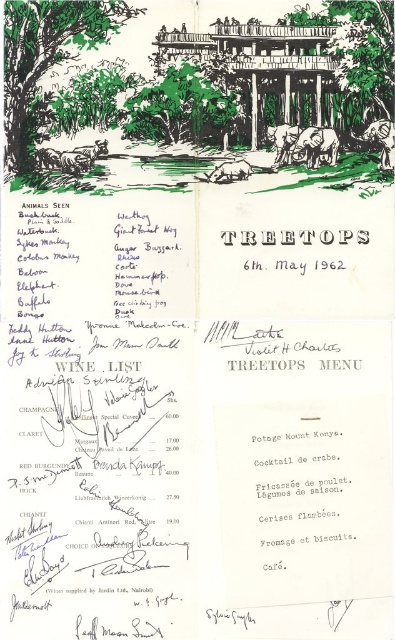
Find the location of a particular element. green ink tree at upper left is located at coordinates (45, 60).

Between green ink tree at upper left and green leafy tree at center, which one has more height?

Standing taller between the two is green ink tree at upper left.

Describe the element at coordinates (45, 60) in the screenshot. Image resolution: width=395 pixels, height=640 pixels. I see `green ink tree at upper left` at that location.

In order to click on green ink tree at upper left in this screenshot , I will do `click(45, 60)`.